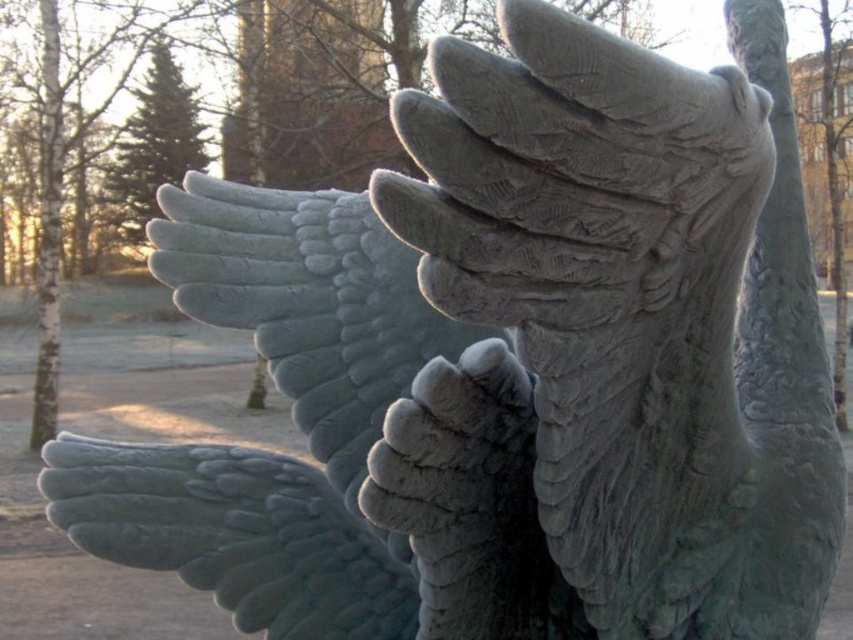
You are an art student analyzing the sculpture. You notice the bronze textured hand at upper center and the green stone wing at lower left. Which object is taller in the image?

The bronze textured hand at upper center is much taller than the green stone wing at lower left.

You are an art student analyzing the sculpture. You notice the bronze textured hand at upper center and the green stone wing at lower left. Which object is positioned to the right of the other?

The bronze textured hand at upper center is positioned to the right of the green stone wing at lower left.

You are an art student analyzing the sculpture. You notice the bronze textured hand at upper center and the green stone wing at lower left. Which of these two objects is bigger in size?

The bronze textured hand at upper center is larger in size compared to the green stone wing at lower left.